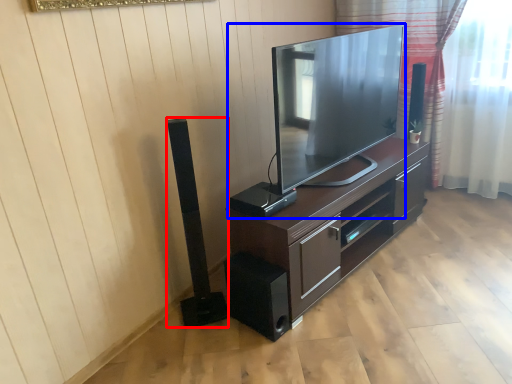
Question: Which of the following is the farthest to the observer, speaker (highlighted by a red box) or television (highlighted by a blue box)?

Choices:
 (A) speaker
 (B) television

Answer: (A)